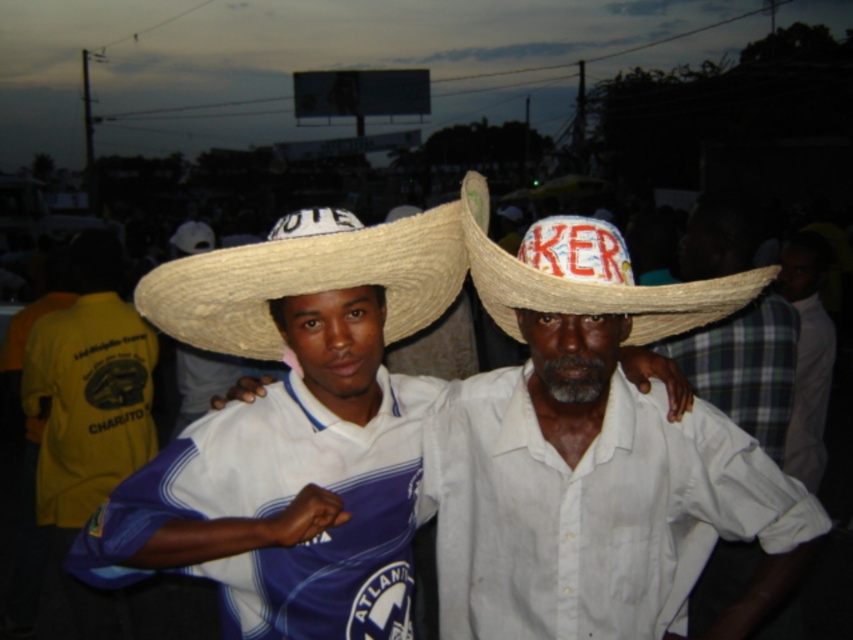
Can you confirm if natural straw hat at center is taller than plaid fabric shirt at right?

Incorrect, natural straw hat at center's height is not larger of plaid fabric shirt at right's.

Between natural straw hat at center and plaid fabric shirt at right, which one appears on the right side from the viewer's perspective?

From the viewer's perspective, plaid fabric shirt at right appears more on the right side.

The image size is (853, 640). Describe the element at coordinates (589, 275) in the screenshot. I see `natural straw hat at center` at that location.

In order to click on natural straw hat at center in this screenshot , I will do `click(589, 275)`.

Is natural straw sombrero at center shorter than straw hat at center?

No, natural straw sombrero at center is not shorter than straw hat at center.

Between natural straw sombrero at center and straw hat at center, which one is positioned lower?

straw hat at center is below.

Is point (322, 264) less distant than point (341, 252)?

No.

You are a GUI agent. You are given a task and a screenshot of the screen. Output one action in this format:
    pyautogui.click(x=<x>, y=<y>)
    Task: Click on the natural straw sombrero at center
    The height and width of the screenshot is (640, 853).
    Given the screenshot: What is the action you would take?
    pyautogui.click(x=427, y=280)

Describe the element at coordinates (427, 280) in the screenshot. I see `natural straw sombrero at center` at that location.

From the picture: Who is higher up, natural straw sombrero at center or natural straw hat at center?

Positioned higher is natural straw hat at center.

Does point (316, 259) come farther from viewer compared to point (589, 288)?

That is True.

At what (x,y) coordinates should I click in order to perform the action: click on natural straw sombrero at center. Please return your answer as a coordinate pair (x, y). Image resolution: width=853 pixels, height=640 pixels. Looking at the image, I should click on (427, 280).